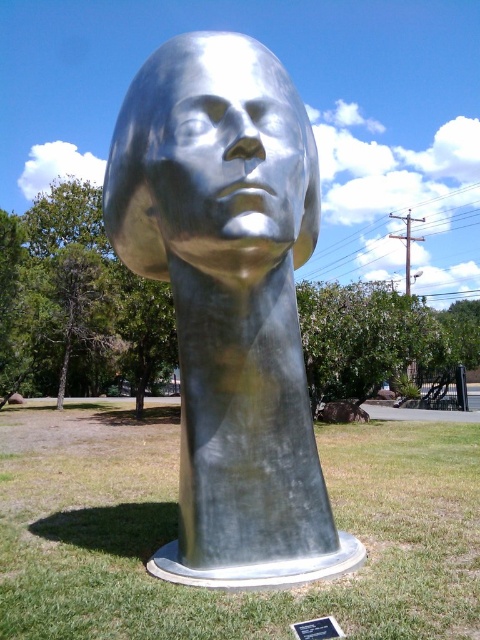
Question: Which of these objects is positioned closest to the shiny metallic face at center?

Choices:
 (A) green grass at center
 (B) shiny metallic head at center
 (C) black metal plaque at center

Answer: (B)

Question: Which object is the closest to the green grass at center?

Choices:
 (A) black metal plaque at center
 (B) shiny metallic face at center
 (C) shiny metallic head at center

Answer: (B)

Question: Does shiny metallic head at center appear over green grass at center?

Choices:
 (A) no
 (B) yes

Answer: (B)

Question: Does shiny metallic head at center appear over black metal plaque at center?

Choices:
 (A) no
 (B) yes

Answer: (B)

Question: Considering the relative positions of shiny metallic face at center and black metal plaque at center in the image provided, where is shiny metallic face at center located with respect to black metal plaque at center?

Choices:
 (A) right
 (B) left

Answer: (B)

Question: Which object is positioned closest to the green grass at center?

Choices:
 (A) black metal plaque at center
 (B) shiny metallic head at center

Answer: (B)